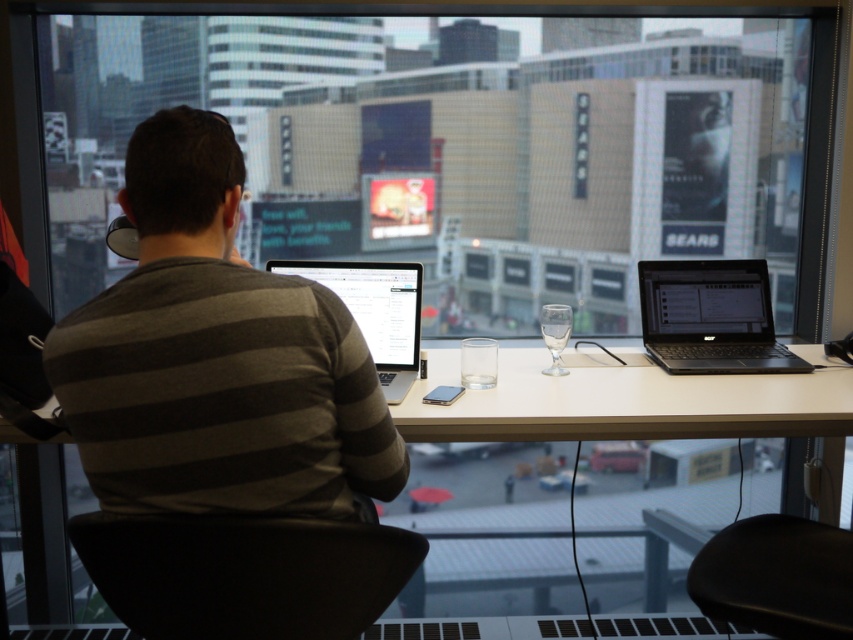
Does black matte laptop at right have a lesser height compared to silver metallic laptop at center?

Correct, black matte laptop at right is not as tall as silver metallic laptop at center.

From the picture: Who is positioned more to the right, black matte laptop at right or silver metallic laptop at center?

black matte laptop at right

Is point (741, 308) positioned behind point (352, 266)?

Yes.

Where is `black matte laptop at right`? black matte laptop at right is located at coordinates (711, 317).

Is point (387, 531) in front of point (717, 429)?

That is True.

Does black leather chair at lower center have a smaller size compared to white glossy computer desk at center?

Indeed, black leather chair at lower center has a smaller size compared to white glossy computer desk at center.

Image resolution: width=853 pixels, height=640 pixels. What do you see at coordinates (244, 573) in the screenshot?
I see `black leather chair at lower center` at bounding box center [244, 573].

At what (x,y) coordinates should I click in order to perform the action: click on black leather chair at lower center. Please return your answer as a coordinate pair (x, y). Looking at the image, I should click on (244, 573).

Does point (567, 381) lie behind point (367, 280)?

No, it is not.

Measure the distance between white glossy computer desk at center and silver metallic laptop at center.

The distance of white glossy computer desk at center from silver metallic laptop at center is 12.57 inches.

Is point (514, 356) closer to viewer compared to point (390, 378)?

No, (514, 356) is behind (390, 378).

Locate an element on the screen. The image size is (853, 640). white glossy computer desk at center is located at coordinates (627, 401).